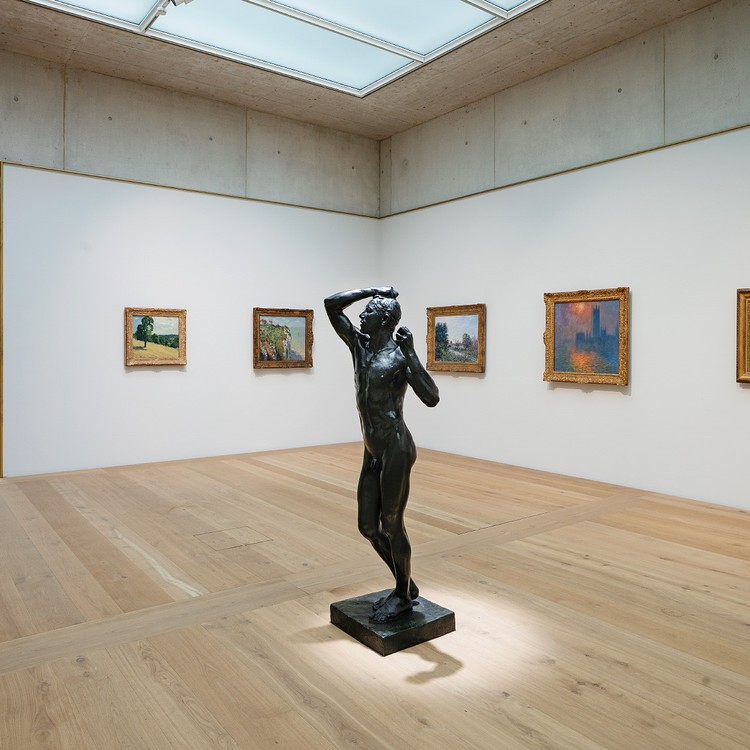
This screenshot has width=750, height=750. In order to click on wood floor in this screenshot , I will do `click(256, 576)`.